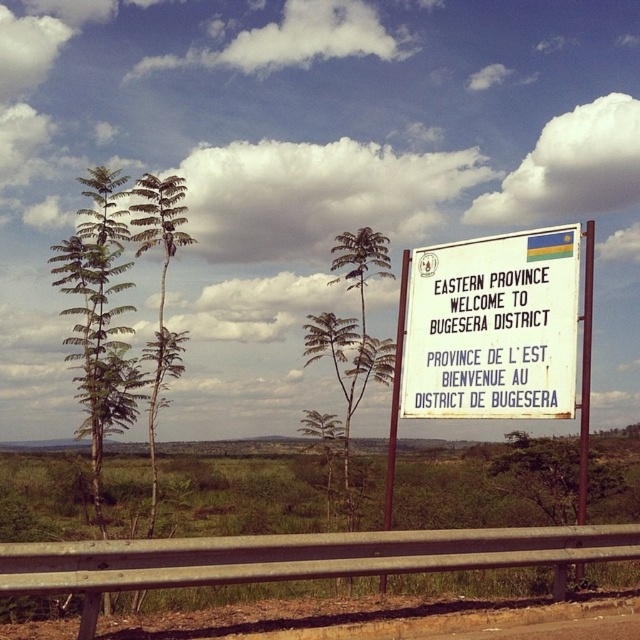
You are a tourist driving along the road and see the white paper sign at upper right and the green leafy palm tree at left. Which object is located to the right of the other?

The white paper sign at upper right is positioned on the right side of green leafy palm tree at left.

You are a tourist standing at the roadside scene. You see a point at coordinate [492,326]. What object is this point located on?

The point at coordinate [492,326] is located on the white paper sign at upper right.

You are a tourist driving along the road and see the white paper sign at center and the white paper sign at upper right on the welcome signboard. Which one is taller?

The white paper sign at center is taller than the white paper sign at upper right.